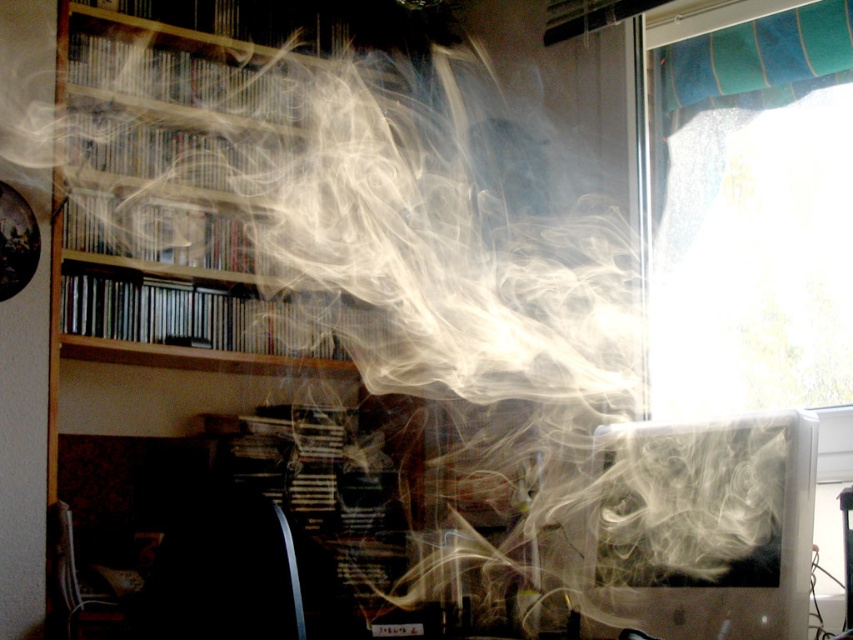
Question: Is transparent glass window at upper right to the right of white glossy computer monitor at lower right from the viewer's perspective?

Choices:
 (A) no
 (B) yes

Answer: (B)

Question: Among these points, which one is farthest from the camera?

Choices:
 (A) (827, 3)
 (B) (631, 540)

Answer: (A)

Question: Does transparent glass window at upper right come behind white glossy computer monitor at lower right?

Choices:
 (A) yes
 (B) no

Answer: (A)

Question: Which of the following is the closest to the observer?

Choices:
 (A) (788, 508)
 (B) (741, 387)

Answer: (A)

Question: Is transparent glass window at upper right further to camera compared to white glossy computer monitor at lower right?

Choices:
 (A) no
 (B) yes

Answer: (B)